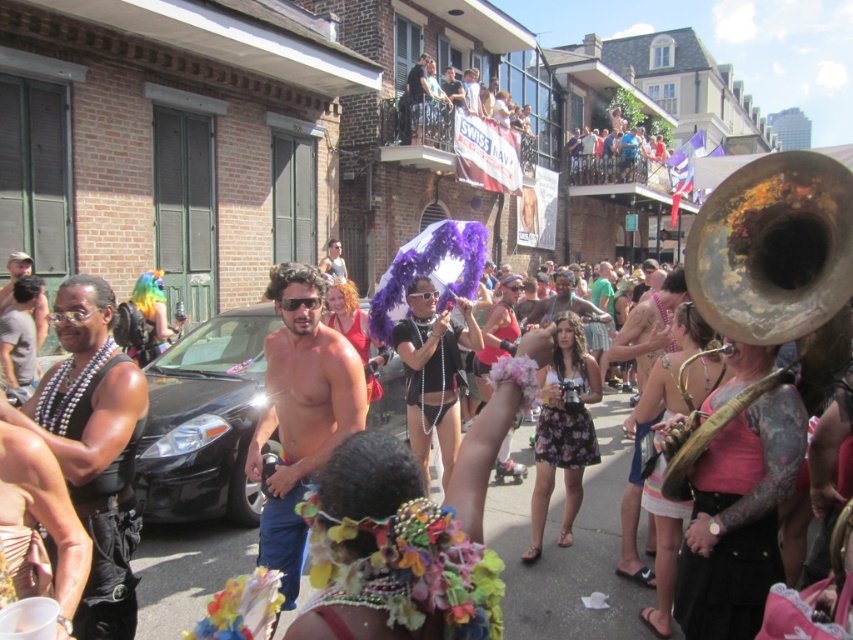
Based on the photo, you are a photographer trying to capture the gold tarnished trumpet at center and the shiny black tank top at upper center in the same frame. Based on their positions, which object should you adjust your camera to focus on first to ensure both are in the shot?

The gold tarnished trumpet at center is positioned on the right side of the shiny black tank top at upper center, so you should focus on the shiny black tank top at upper center first to ensure both objects are within the frame.

You are a photographer trying to capture the gold tarnished trumpet at center and the shiny black tank top at upper center in the same frame. Which object should you focus on first if you want to ensure both are in focus, considering their sizes?

The gold tarnished trumpet at center is thinner than the shiny black tank top at upper center, so you should focus on the shiny black tank top at upper center first because larger objects require more precise focusing to ensure sharpness throughout.

You are a photographer at the parade. You want to capture a photo of the black leather vest at center and the black matte car at center. Which one is positioned higher in the image?

The black leather vest at center is located above the black matte car at center, so it is positioned higher in the image.